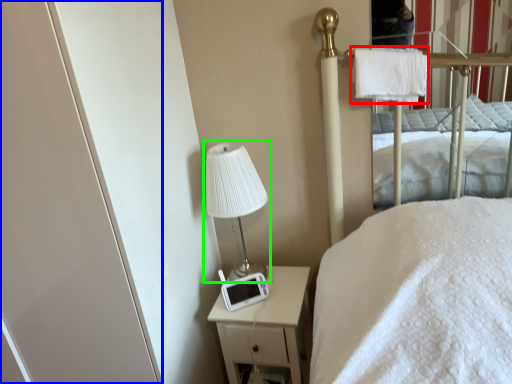
Question: Considering the real-world distances, which object is closest to cloth (highlighted by a red box)? screen door (highlighted by a blue box) or table lamp (highlighted by a green box).

Choices:
 (A) screen door
 (B) table lamp

Answer: (B)